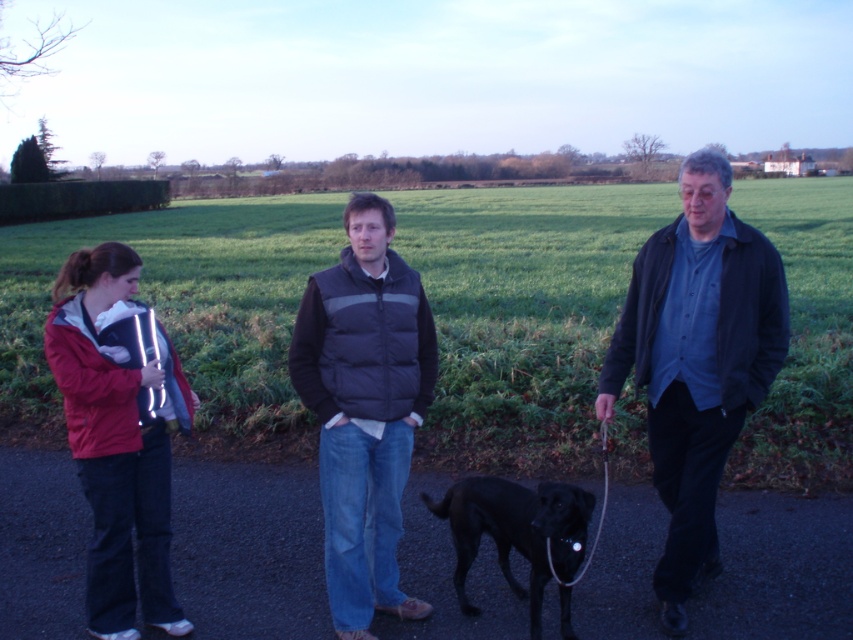
You are a photographer standing at the end of the path. You want to take a photo that includes both the dark blue jacket at right and the red fleece jacket at left. Which jacket will appear closer to the camera in the photo?

The dark blue jacket at right will appear closer to the camera because it is positioned further to the viewer than the red fleece jacket at left.

You are standing at point (107, 346) and want to move towards point (741, 426). Is the direction you need to walk towards north, south, east, or west?

The point (741, 426) is behind point (107, 346), so you should walk north to reach it.